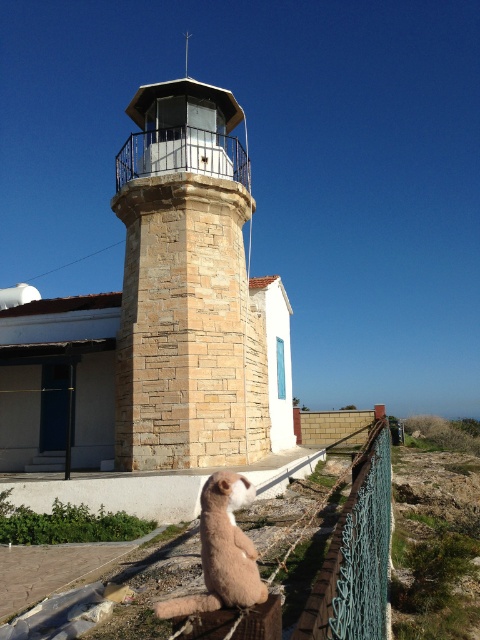
You are a visitor standing at the base of the stone textured tower at center. You notice a green wire mesh at right in the distance. From your current position, which object is closer to you?

The stone textured tower at center is closer to you because it is in front of the green wire mesh at right, which is positioned behind it according to the description.

You are a delivery drone carrying a package for the lighthouse keeper. The lighthouse is the stone textured tower at center, and the fuzzy beige cat at lower center is blocking your path. Can you fly over the cat to reach the lighthouse?

The distance between the stone textured tower at center and the fuzzy beige cat at lower center is 9.78 meters. Since the cat is blocking your path but the distance is sufficient, you can safely fly over the cat to reach the lighthouse.

You are a bird flying over the coastal area and want to land on the highest point. Which object should you choose between the stone textured tower at center and the green wire mesh at right?

The stone textured tower at center is much taller than the green wire mesh at right, so you should land on the stone textured tower at center.